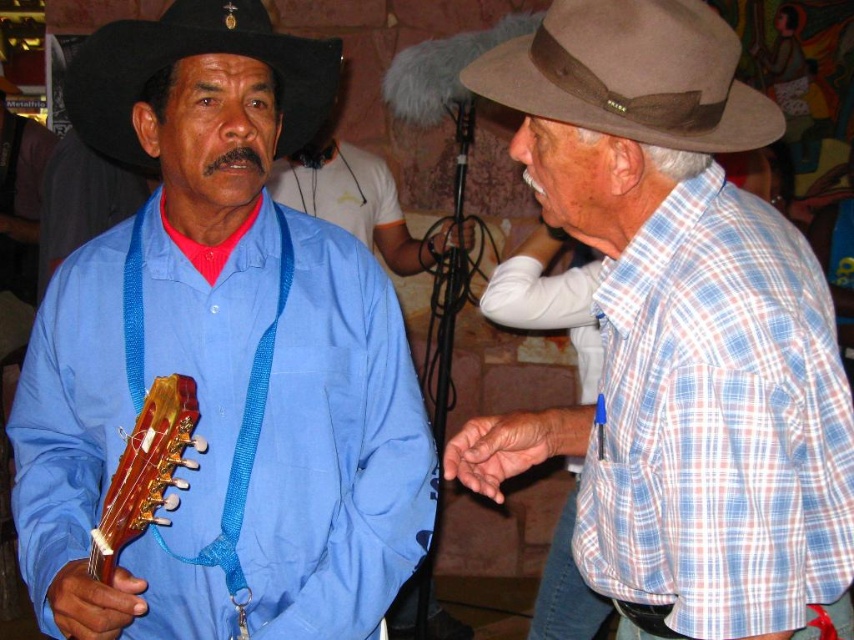
Question: Which object is farther from the camera taking this photo?

Choices:
 (A) blue woven shirt at center
 (B) brown felt fedora at upper right

Answer: (B)

Question: Among these points, which one is farthest from the camera?

Choices:
 (A) (92, 35)
 (B) (658, 4)
 (C) (659, 19)

Answer: (A)

Question: Is blue woven shirt at center to the left of black felt fedora at upper left from the viewer's perspective?

Choices:
 (A) no
 (B) yes

Answer: (A)

Question: Does matte blue shirt at center lie behind blue woven shirt at center?

Choices:
 (A) yes
 (B) no

Answer: (A)

Question: Considering the real-world distances, which object is closest to the brown felt fedora at upper right?

Choices:
 (A) blue woven shirt at center
 (B) wooden acoustic guitar at left

Answer: (A)

Question: Is matte blue shirt at center behind black felt fedora at upper left?

Choices:
 (A) no
 (B) yes

Answer: (A)